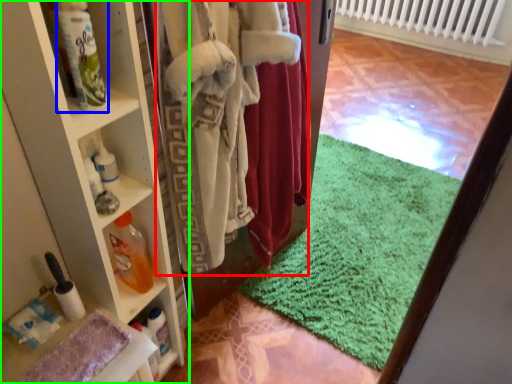
Question: Estimate the real-world distances between objects in this image. Which object is closer to clothing (highlighted by a red box), bottle (highlighted by a blue box) or shelf (highlighted by a green box)?

Choices:
 (A) bottle
 (B) shelf

Answer: (B)